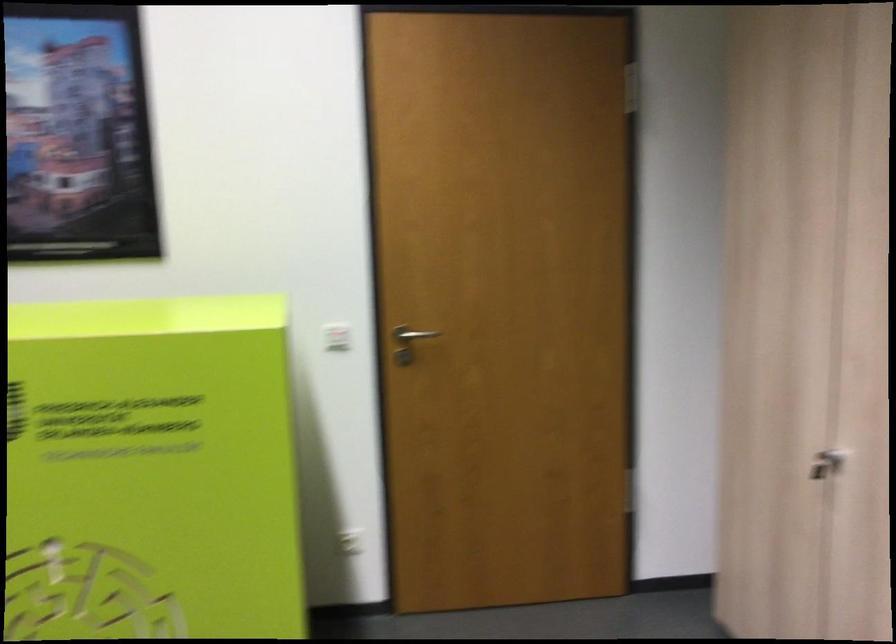
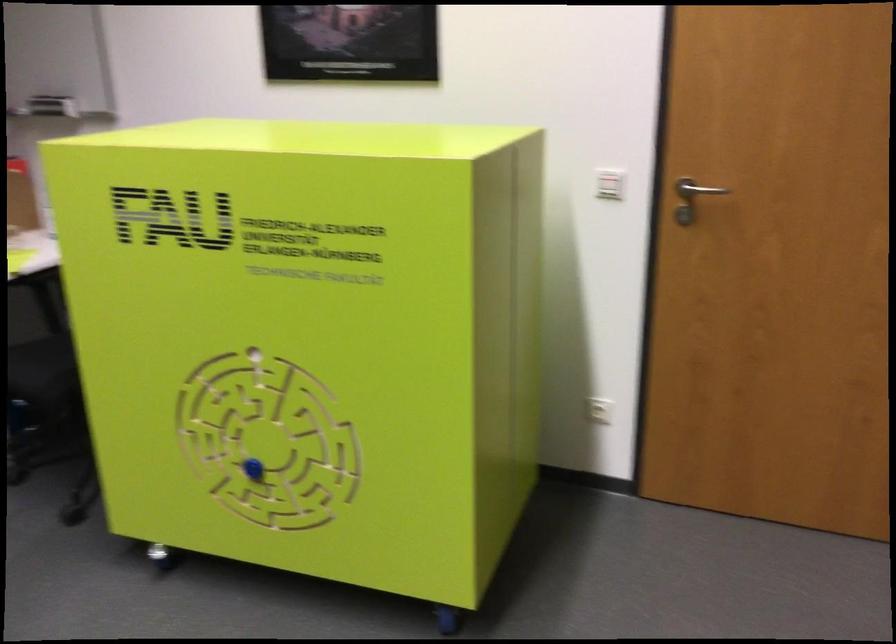
Question: The camera is either moving clockwise (left) or counter-clockwise (right) around the object. The first image is from the beginning of the video and the second image is from the end. Is the camera moving left or right when shooting the video?

Choices:
 (A) Left
 (B) Right

Answer: (B)